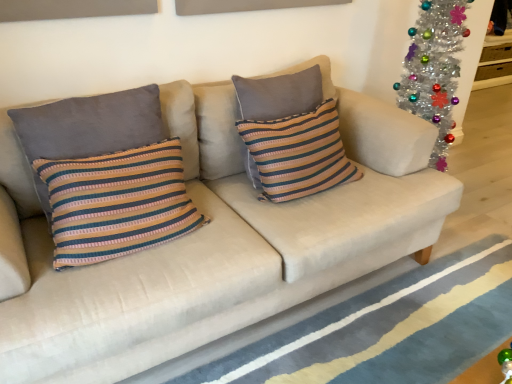
What do you see at coordinates (352, 317) in the screenshot? The width and height of the screenshot is (512, 384). I see `blue striped rug at lower center` at bounding box center [352, 317].

The height and width of the screenshot is (384, 512). I want to click on striped fabric pillow at left, which is the second pillow in right-to-left order, so click(90, 125).

Where is `striped fabric pillow at center, positioned as the 1th pillow in right-to-left order`? Image resolution: width=512 pixels, height=384 pixels. striped fabric pillow at center, positioned as the 1th pillow in right-to-left order is located at coordinates (298, 153).

Is striped fabric pillow at center, the second pillow positioned from the left, at the back of striped fabric pillow at left, which is the second pillow in right-to-left order?

No, striped fabric pillow at center, the second pillow positioned from the left, is not at the back of striped fabric pillow at left, which is the second pillow in right-to-left order.

Considering the sizes of striped fabric pillow at left, which is the second pillow in right-to-left order, and striped fabric pillow at center, positioned as the 1th pillow in right-to-left order, in the image, is striped fabric pillow at left, which is the second pillow in right-to-left order, taller or shorter than striped fabric pillow at center, positioned as the 1th pillow in right-to-left order,?

Clearly, striped fabric pillow at left, which is the second pillow in right-to-left order, is shorter compared to striped fabric pillow at center, positioned as the 1th pillow in right-to-left order.

Would you say striped fabric pillow at left, acting as the first pillow starting from the left, is outside striped fabric pillow at center, the second pillow positioned from the left?

Absolutely, striped fabric pillow at left, acting as the first pillow starting from the left, is external to striped fabric pillow at center, the second pillow positioned from the left.

Is blue striped rug at lower center taller than striped fabric pillow at left, which is the second pillow in right-to-left order?

In fact, blue striped rug at lower center may be shorter than striped fabric pillow at left, which is the second pillow in right-to-left order.

Considering the sizes of objects blue striped rug at lower center and striped fabric pillow at left, acting as the first pillow starting from the left, in the image provided, who is wider, blue striped rug at lower center or striped fabric pillow at left, acting as the first pillow starting from the left,?

With larger width is blue striped rug at lower center.

Is blue striped rug at lower center next to striped fabric pillow at left, acting as the first pillow starting from the left?

No, blue striped rug at lower center is not beside striped fabric pillow at left, acting as the first pillow starting from the left.

How far apart are blue striped rug at lower center and striped fabric pillow at left, which is the second pillow in right-to-left order?

A distance of 38.18 inches exists between blue striped rug at lower center and striped fabric pillow at left, which is the second pillow in right-to-left order.

Looking at this image, is striped fabric pillow at center, the second pillow positioned from the left, at the back of blue striped rug at lower center?

blue striped rug at lower center does not have its back to striped fabric pillow at center, the second pillow positioned from the left.

In terms of size, does blue striped rug at lower center appear bigger or smaller than striped fabric pillow at center, positioned as the 1th pillow in right-to-left order?

Considering their sizes, blue striped rug at lower center takes up less space than striped fabric pillow at center, positioned as the 1th pillow in right-to-left order.

Which point is more distant from viewer, [386,349] or [298,131]?

The point [298,131] is behind.

Between blue striped rug at lower center and striped fabric pillow at center, the second pillow positioned from the left, which one has smaller width?

Thinner between the two is striped fabric pillow at center, the second pillow positioned from the left.

Can we say striped fabric pillow at center, positioned as the 1th pillow in right-to-left order, lies outside striped fabric pillow at left, acting as the first pillow starting from the left?

Yes.

Is striped fabric pillow at center, positioned as the 1th pillow in right-to-left order, turned away from striped fabric pillow at left, acting as the first pillow starting from the left?

striped fabric pillow at center, positioned as the 1th pillow in right-to-left order, is not turned away from striped fabric pillow at left, acting as the first pillow starting from the left.

Is striped fabric pillow at center, the second pillow positioned from the left, positioned far away from striped fabric pillow at left, acting as the first pillow starting from the left?

No, striped fabric pillow at center, the second pillow positioned from the left, is not far from striped fabric pillow at left, acting as the first pillow starting from the left.

Is striped fabric pillow at center, the second pillow positioned from the left, turned away from blue striped rug at lower center?

No, striped fabric pillow at center, the second pillow positioned from the left, is not facing away from blue striped rug at lower center.

Between striped fabric pillow at center, the second pillow positioned from the left, and blue striped rug at lower center, which one appears on the left side from the viewer's perspective?

striped fabric pillow at center, the second pillow positioned from the left.

From the image's perspective, is striped fabric pillow at center, positioned as the 1th pillow in right-to-left order, located above or below blue striped rug at lower center?

From the image's perspective, striped fabric pillow at center, positioned as the 1th pillow in right-to-left order, appears above blue striped rug at lower center.

In terms of height, does striped fabric pillow at center, the second pillow positioned from the left, look taller or shorter compared to blue striped rug at lower center?

In the image, striped fabric pillow at center, the second pillow positioned from the left, appears to be taller than blue striped rug at lower center.

Is striped fabric pillow at left, acting as the first pillow starting from the left, not within blue striped rug at lower center?

Yes, striped fabric pillow at left, acting as the first pillow starting from the left, is outside of blue striped rug at lower center.

Is striped fabric pillow at left, acting as the first pillow starting from the left, thinner than blue striped rug at lower center?

Yes, striped fabric pillow at left, acting as the first pillow starting from the left, is thinner than blue striped rug at lower center.

Between striped fabric pillow at left, acting as the first pillow starting from the left, and blue striped rug at lower center, which one is positioned behind?

striped fabric pillow at left, acting as the first pillow starting from the left.

Is striped fabric pillow at left, which is the second pillow in right-to-left order, not close to blue striped rug at lower center?

striped fabric pillow at left, which is the second pillow in right-to-left order, is near blue striped rug at lower center, not far away.

The image size is (512, 384). What are the coordinates of `pillow above the striped fabric pillow at left, acting as the first pillow starting from the left (from the image's perspective)` in the screenshot? It's located at (298, 153).

Identify the location of stripe that is below the striped fabric pillow at left, which is the second pillow in right-to-left order (from the image's perspective). This screenshot has height=384, width=512. (352, 317).

Looking at the image, which one is located further to striped fabric pillow at left, acting as the first pillow starting from the left, striped fabric pillow at center, positioned as the 1th pillow in right-to-left order, or blue striped rug at lower center?

Based on the image, blue striped rug at lower center appears to be further to striped fabric pillow at left, acting as the first pillow starting from the left.

Which object lies further to the anchor point blue striped rug at lower center, striped fabric pillow at left, acting as the first pillow starting from the left, or striped fabric pillow at center, positioned as the 1th pillow in right-to-left order?

The object further to blue striped rug at lower center is striped fabric pillow at left, acting as the first pillow starting from the left.

From the image, which object appears to be farther from striped fabric pillow at center, positioned as the 1th pillow in right-to-left order, striped fabric pillow at left, acting as the first pillow starting from the left, or blue striped rug at lower center?

Among the two, blue striped rug at lower center is located further to striped fabric pillow at center, positioned as the 1th pillow in right-to-left order.

Looking at the image, which one is located closer to striped fabric pillow at left, acting as the first pillow starting from the left, blue striped rug at lower center or striped fabric pillow at center, the second pillow positioned from the left?

Among the two, striped fabric pillow at center, the second pillow positioned from the left, is located nearer to striped fabric pillow at left, acting as the first pillow starting from the left.

When comparing their distances from striped fabric pillow at center, positioned as the 1th pillow in right-to-left order, does blue striped rug at lower center or striped fabric pillow at left, which is the second pillow in right-to-left order, seem closer?

Based on the image, striped fabric pillow at left, which is the second pillow in right-to-left order, appears to be nearer to striped fabric pillow at center, positioned as the 1th pillow in right-to-left order.

From the picture: When comparing their distances from blue striped rug at lower center, does striped fabric pillow at center, the second pillow positioned from the left, or striped fabric pillow at left, acting as the first pillow starting from the left, seem further?

Based on the image, striped fabric pillow at left, acting as the first pillow starting from the left, appears to be further to blue striped rug at lower center.

Locate an element on the screen. pillow between striped fabric pillow at left, acting as the first pillow starting from the left, and blue striped rug at lower center from left to right is located at coordinates (298, 153).